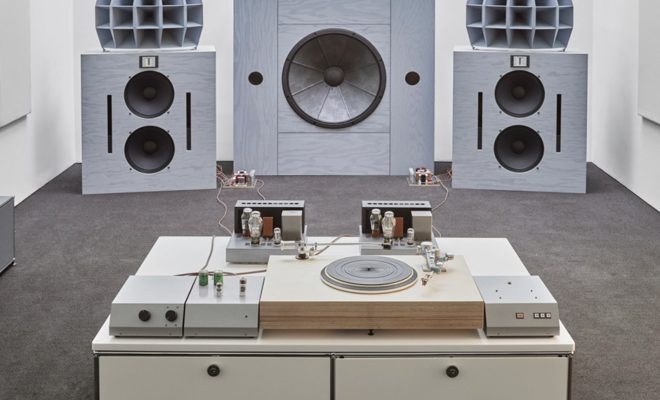
Where is `drawer`? The image size is (660, 400). drawer is located at coordinates (158, 379), (523, 371).